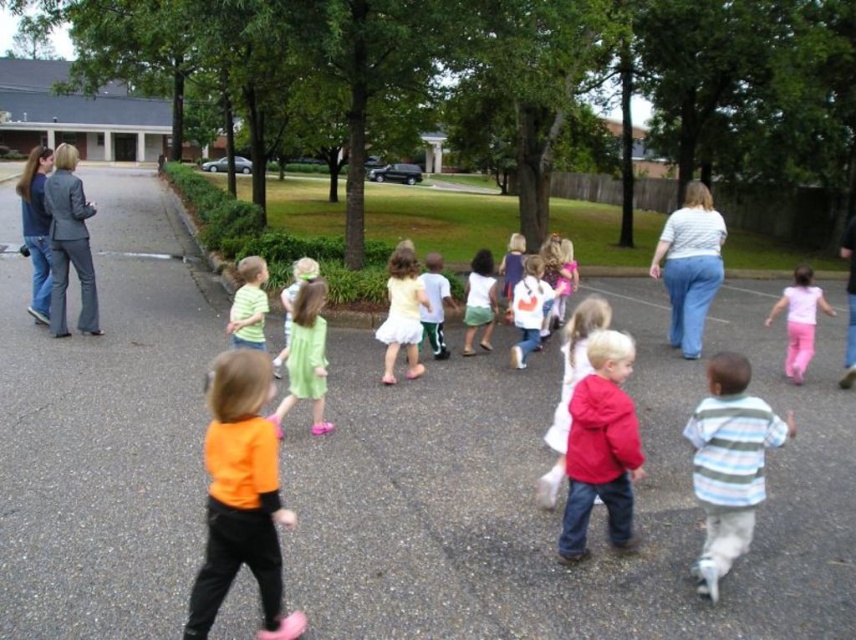
You are a photographer trying to capture a clear photo of the white matte shirt at center and the green cotton dress at center. Since the camera can only focus on one object at a time, which object should you focus on first to ensure it takes up more of the frame?

The green cotton dress at center occupies more space than the white matte shirt at center, so you should focus on the green cotton dress at center first to ensure it takes up more of the frame.

You are a photographer trying to capture a photo of the group of children and adults. You want to ensure both the white matte shirt at center and the green cotton dress at center are clearly visible in the frame. Based on their positions, which one should you focus on first to ensure both are in focus?

The white matte shirt at center is to the right of the green cotton dress at center. To ensure both are in focus, you should focus on the green cotton dress at center first since it is closer to the left side, allowing the depth of field to cover the rightward positioned white matte shirt at center.

You are a photographer positioned at the white matte shirt at center. You want to capture a photo of the other adult who is 9.83 meters away. What is the minimum distance you need to walk to reach them?

The minimum distance you need to walk is 9.83 meters to reach the other adult.